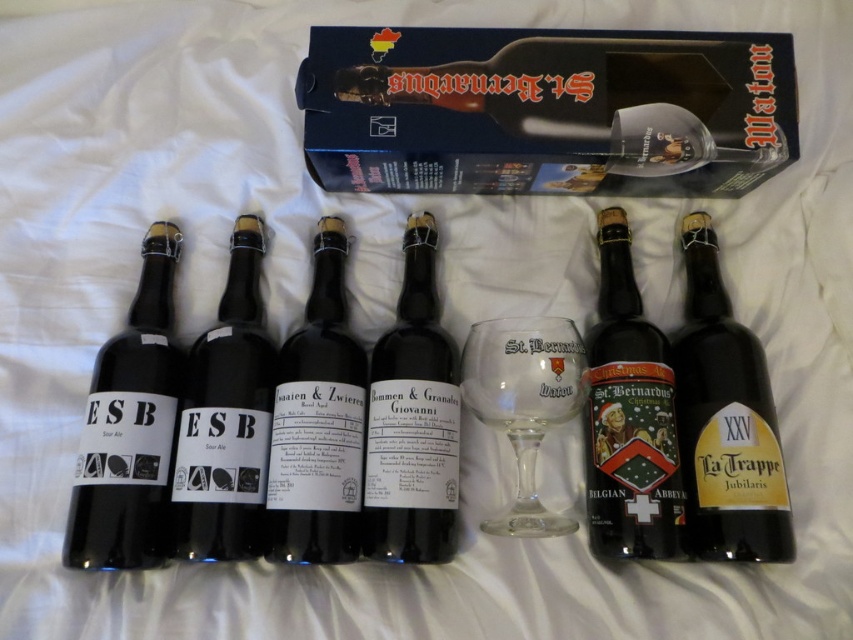
You are standing in front of the bottles and want to pick up the dark brown glass bottle at center. Which direction should you move your hand to reach it?

The dark brown glass bottle at center is located at point (415, 422), so you should move your hand towards the center of the row of bottles to reach it.

From the picture: You are at a bar and want to choose between the matte black bottle at center and the black matte bottle at center. Which one has a smaller diameter?

The matte black bottle at center is thinner than the black matte bottle at center, so the matte black bottle at center has a smaller diameter.

You are setting up a table for a beer tasting event. You have a dark brown glass bottle at center and a transparent glass wine glass at center. Which object should you place closer to the guests to ensure they can easily pour the beer into the glass?

The dark brown glass bottle at center should be placed closer to the guests because it is in front of the transparent glass wine glass at center, allowing easier access for pouring.